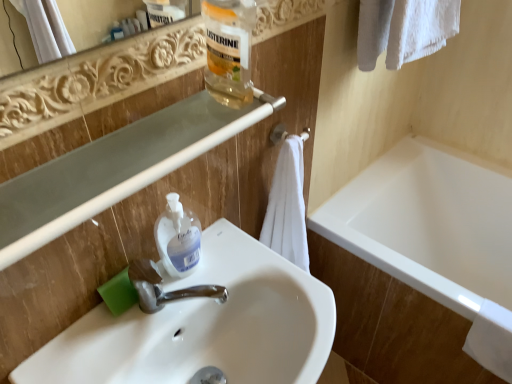
The height and width of the screenshot is (384, 512). Find the location of `free space underneath clear plastic balustrade at upper center (from a real-world perspective)`. free space underneath clear plastic balustrade at upper center (from a real-world perspective) is located at coordinates (182, 287).